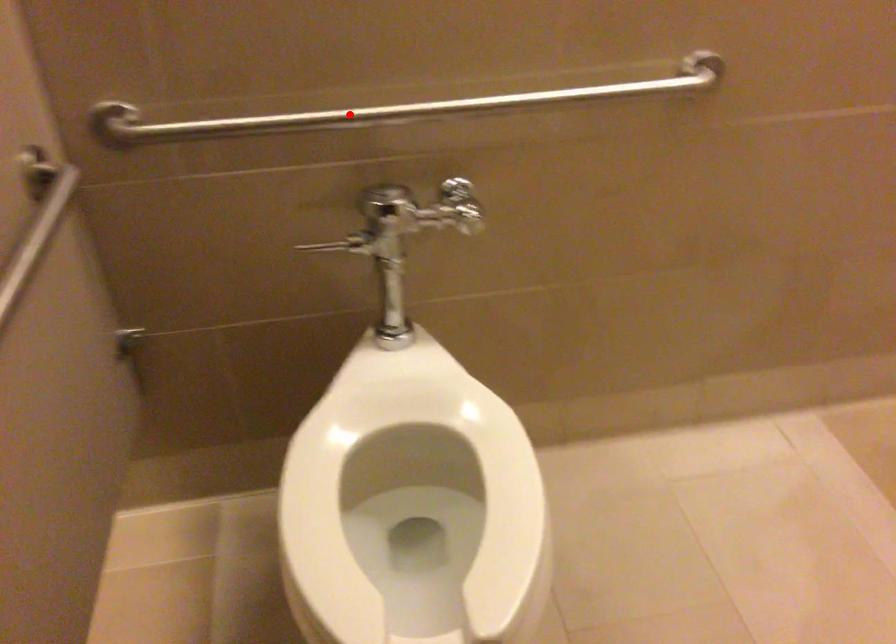
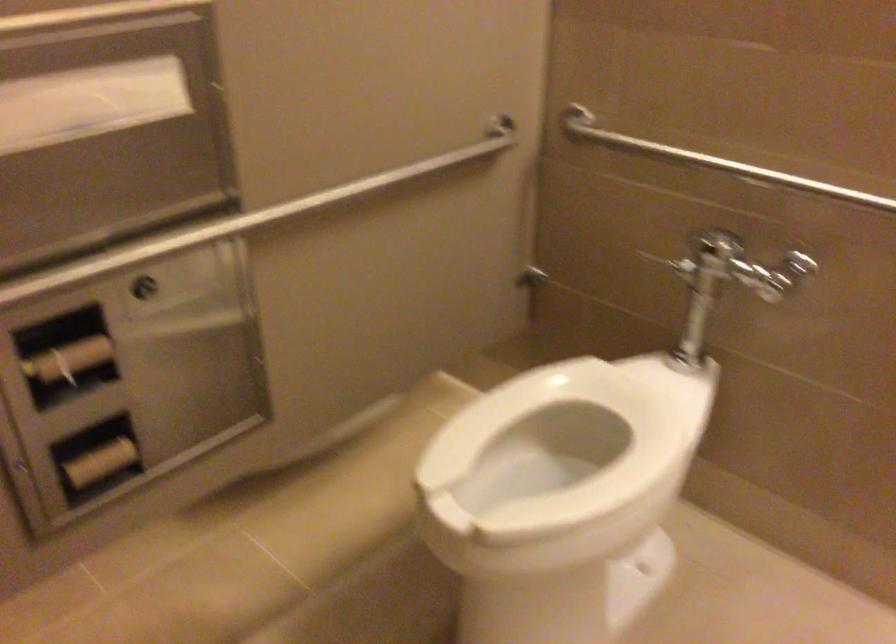
Question: I am providing you with two images of the same scene from different viewpoints. Given a red point in image1, look at the same physical point in image2. Is it:

Choices:
 (A) Closer to the viewpoint
 (B) Farther from the viewpoint

Answer: (B)